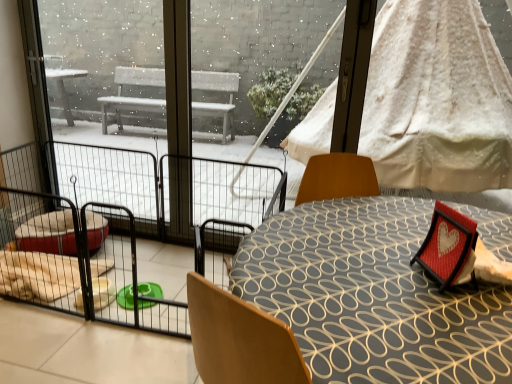
Where is `free space to the back side of red fabric heart frame at lower right`? The width and height of the screenshot is (512, 384). free space to the back side of red fabric heart frame at lower right is located at coordinates (413, 225).